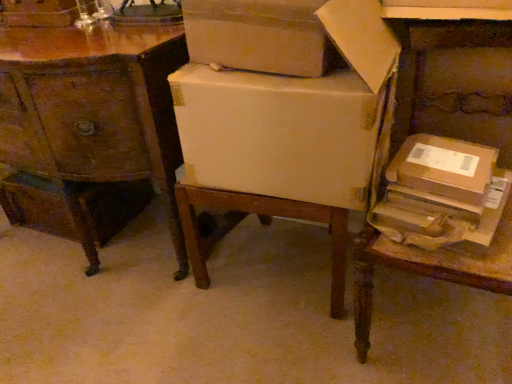
Question: Is brown wooden table at right in front of wooden drawer at left, the second storage box when ordered from front to back?

Choices:
 (A) no
 (B) yes

Answer: (B)

Question: Is brown wooden table at right wider than wooden drawer at left, the 1th storage box when ordered from left to right?

Choices:
 (A) yes
 (B) no

Answer: (A)

Question: Considering the relative sizes of brown wooden table at right and wooden drawer at left, the second storage box when ordered from front to back, in the image provided, is brown wooden table at right shorter than wooden drawer at left, the second storage box when ordered from front to back,?

Choices:
 (A) yes
 (B) no

Answer: (B)

Question: Is brown wooden table at right outside wooden drawer at left, the 1th storage box when ordered from left to right?

Choices:
 (A) no
 (B) yes

Answer: (B)

Question: Is brown wooden table at right bigger than wooden drawer at left, the second storage box when ordered from front to back?

Choices:
 (A) no
 (B) yes

Answer: (B)

Question: Would you consider brown wooden table at right to be distant from wooden drawer at left, the second storage box when ordered from front to back?

Choices:
 (A) yes
 (B) no

Answer: (A)

Question: Is brown wooden table at right to the right of matte cardboard box at center, the first cardboard box from the left, from the viewer's perspective?

Choices:
 (A) yes
 (B) no

Answer: (A)

Question: Is brown wooden table at right smaller than matte cardboard box at center, placed as the 2th cardboard box when sorted from right to left?

Choices:
 (A) no
 (B) yes

Answer: (A)

Question: Is brown wooden table at right beside matte cardboard box at center, the first cardboard box from the left?

Choices:
 (A) no
 (B) yes

Answer: (A)

Question: Considering the relative sizes of brown wooden table at right and matte cardboard box at center, placed as the 2th cardboard box when sorted from right to left, in the image provided, is brown wooden table at right thinner than matte cardboard box at center, placed as the 2th cardboard box when sorted from right to left,?

Choices:
 (A) no
 (B) yes

Answer: (B)

Question: From a real-world perspective, does brown wooden table at right stand above matte cardboard box at center, the first cardboard box from the left?

Choices:
 (A) yes
 (B) no

Answer: (B)

Question: Does brown wooden table at right have a greater height compared to matte cardboard box at center, the first cardboard box from the left?

Choices:
 (A) yes
 (B) no

Answer: (A)

Question: Does brown wooden table at right have a greater width compared to wooden desk at center?

Choices:
 (A) yes
 (B) no

Answer: (B)